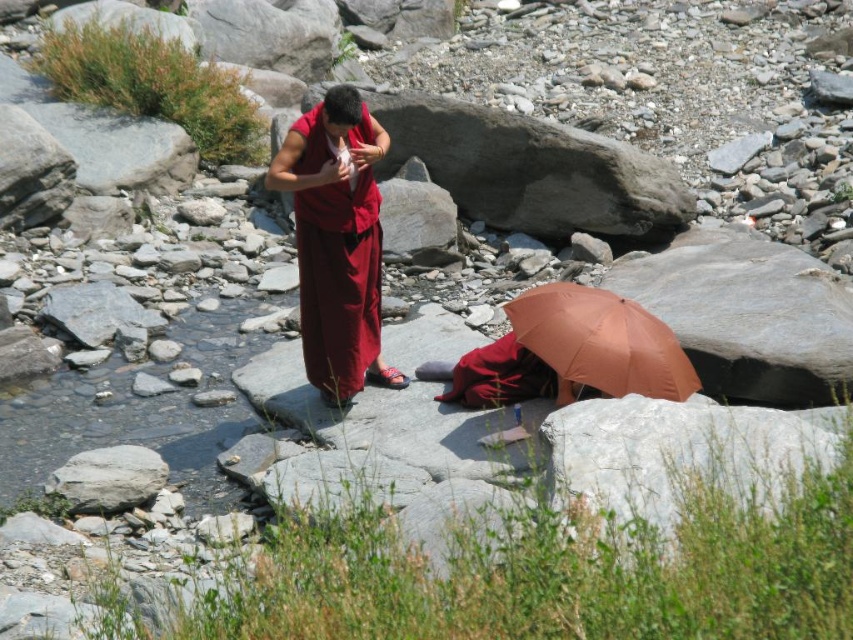
Question: Considering the real-world distances, which object is farthest from the maroon silk robe at center?

Choices:
 (A) white smooth rock at lower left
 (B) orange matte umbrella at lower center

Answer: (A)

Question: In this image, where is orange matte umbrella at lower center located relative to white smooth rock at lower left?

Choices:
 (A) above
 (B) below

Answer: (A)

Question: Among these points, which one is nearest to the camera?

Choices:
 (A) (152, 465)
 (B) (560, 326)

Answer: (B)

Question: Is orange matte umbrella at lower center wider than white smooth rock at lower left?

Choices:
 (A) yes
 (B) no

Answer: (A)

Question: Considering the real-world distances, which object is farthest from the white smooth rock at lower left?

Choices:
 (A) maroon silk robe at center
 (B) orange matte umbrella at lower center

Answer: (B)

Question: Can you confirm if maroon silk robe at center is positioned above white smooth rock at lower left?

Choices:
 (A) yes
 (B) no

Answer: (A)